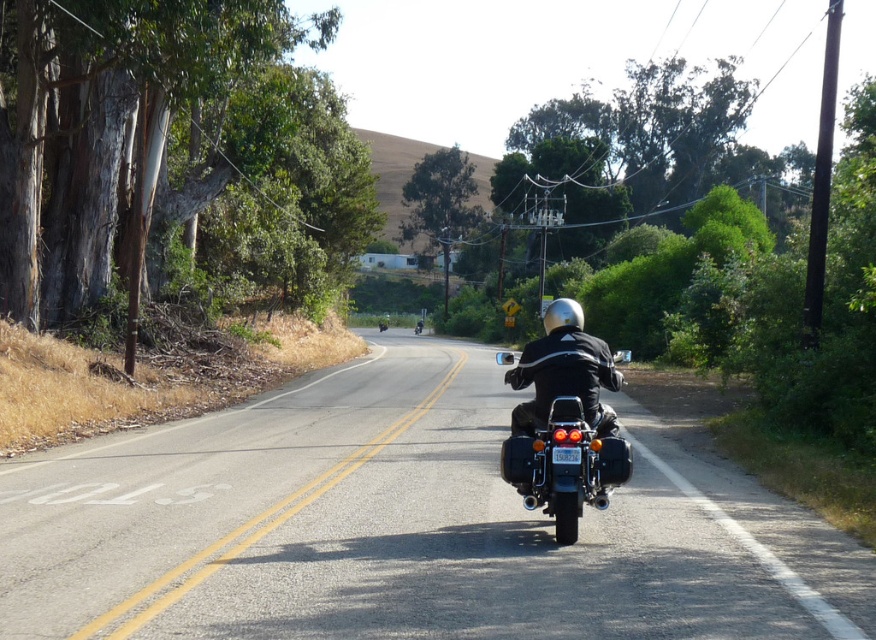
Question: Is black asphalt road at center to the right of black leather jacket at center from the viewer's perspective?

Choices:
 (A) no
 (B) yes

Answer: (A)

Question: Is black asphalt road at center to the left of black leather jacket at center from the viewer's perspective?

Choices:
 (A) yes
 (B) no

Answer: (A)

Question: Which of the following is the farthest from the observer?

Choices:
 (A) 696,545
 (B) 550,486

Answer: (A)

Question: Is black asphalt road at center wider than black leather jacket at center?

Choices:
 (A) no
 (B) yes

Answer: (B)